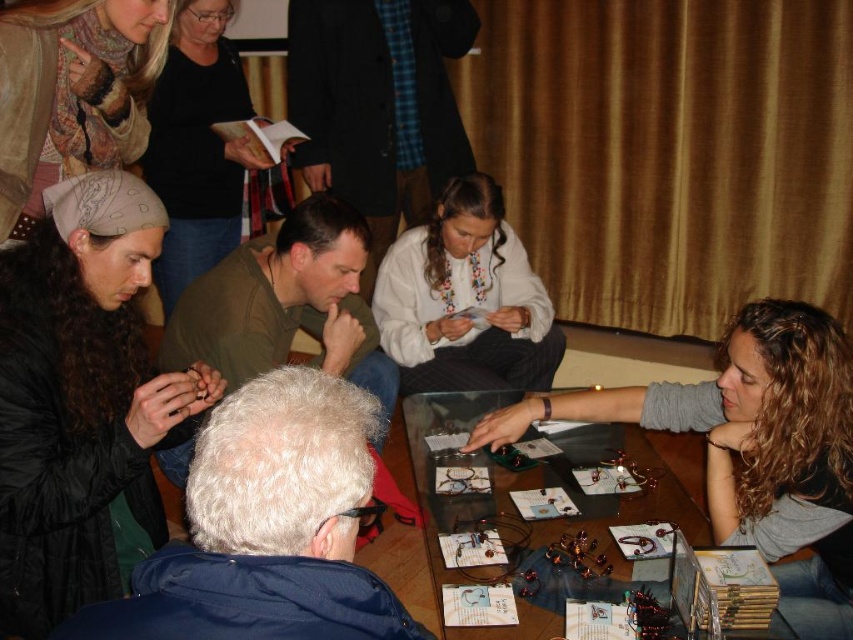
Is point (102, 308) positioned before point (44, 72)?

Yes, point (102, 308) is closer to viewer.

Locate an element on the screen. matte black hair at upper left is located at coordinates (82, 401).

From the picture: How far apart are transparent glass table at center and white embroidered blouse at center?

A distance of 16.95 inches exists between transparent glass table at center and white embroidered blouse at center.

Which is more to the left, transparent glass table at center or white embroidered blouse at center?

Positioned to the left is white embroidered blouse at center.

Which is in front, point (521, 477) or point (419, 260)?

Point (521, 477) is in front.

This screenshot has height=640, width=853. In order to click on transparent glass table at center in this screenshot , I will do `click(547, 484)`.

Describe the element at coordinates (465, 300) in the screenshot. I see `white embroidered blouse at center` at that location.

Who is shorter, white embroidered blouse at center or black fabric shirt at upper center?

Standing shorter between the two is white embroidered blouse at center.

Identify the location of white embroidered blouse at center. This screenshot has width=853, height=640. (465, 300).